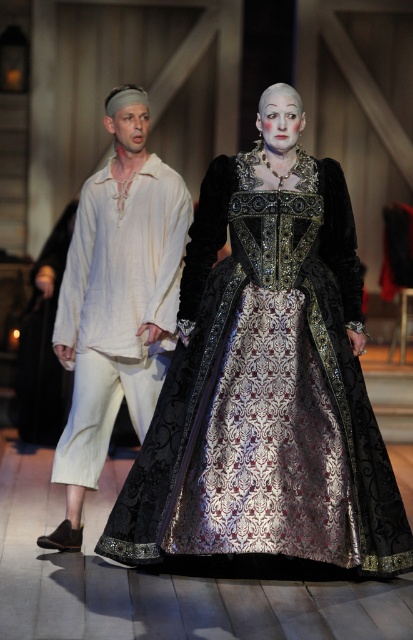
Measure the distance between silvery brocade dress at center and light beige linen shirt at left.

silvery brocade dress at center and light beige linen shirt at left are 24.34 inches apart.

Does silvery brocade dress at center have a greater height compared to light beige linen shirt at left?

In fact, silvery brocade dress at center may be shorter than light beige linen shirt at left.

Where is `silvery brocade dress at center`? This screenshot has height=640, width=413. silvery brocade dress at center is located at coordinates (296, 378).